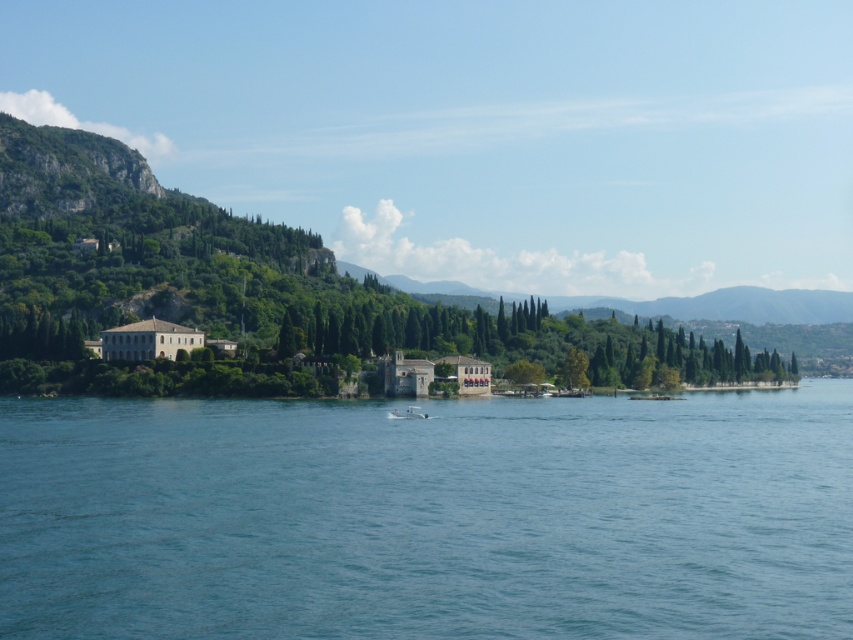
This screenshot has height=640, width=853. Identify the location of green leafy tree at center. (524, 372).

Consider the image. Which is below, green leafy tree at center or white plastic boat at center?

white plastic boat at center

The height and width of the screenshot is (640, 853). What do you see at coordinates (524, 372) in the screenshot?
I see `green leafy tree at center` at bounding box center [524, 372].

Locate an element on the screen. The width and height of the screenshot is (853, 640). green leafy tree at center is located at coordinates (524, 372).

Which is behind, point (144, 433) or point (409, 417)?

Positioned behind is point (409, 417).

Which is in front, point (498, 445) or point (390, 417)?

Point (498, 445)

You are a GUI agent. You are given a task and a screenshot of the screen. Output one action in this format:
    pyautogui.click(x=<x>, y=<y>)
    Task: Click on the blue water at center
    
    Given the screenshot: What is the action you would take?
    pyautogui.click(x=428, y=516)

Locate an element on the screen. The image size is (853, 640). blue water at center is located at coordinates (428, 516).

Which of these two, blue water at center or green leafy tree at center, stands shorter?

Standing shorter between the two is green leafy tree at center.

Can you confirm if blue water at center is wider than green leafy tree at center?

Yes, blue water at center is wider than green leafy tree at center.

Measure the distance between blue water at center and camera.

A distance of 84.38 feet exists between blue water at center and camera.

The width and height of the screenshot is (853, 640). I want to click on blue water at center, so click(x=428, y=516).